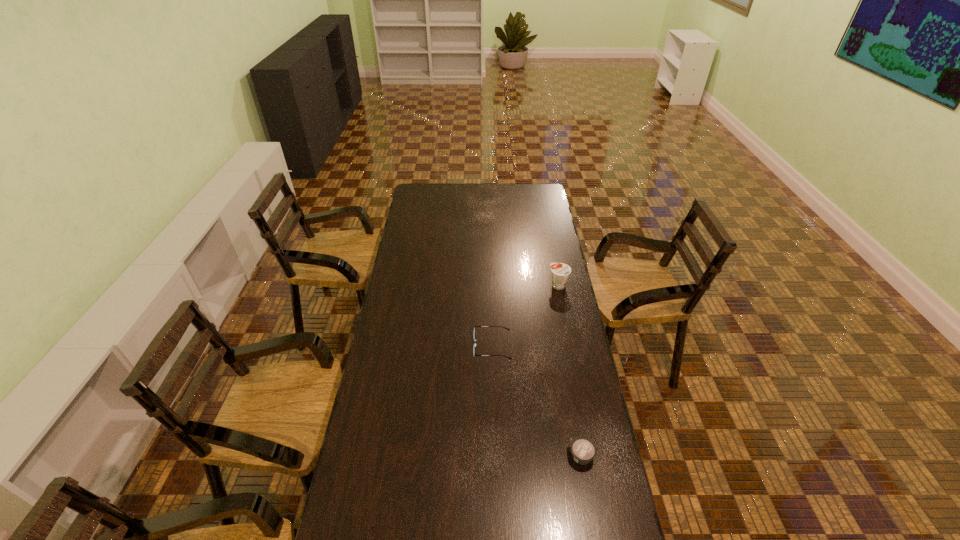
In order to click on vacant area in the image that satisfies the following two spatial constraints: 1. on the lenses of the nearest object; 2. on the left side of the spectacles in this screenshot , I will do `click(495, 456)`.

Where is `vacant space that satisfies the following two spatial constraints: 1. on the lenses of the second nearest object; 2. on the right side of the nearer yogurt`? The height and width of the screenshot is (540, 960). vacant space that satisfies the following two spatial constraints: 1. on the lenses of the second nearest object; 2. on the right side of the nearer yogurt is located at coordinates (495, 456).

I want to click on vacant region that satisfies the following two spatial constraints: 1. on the back side of the tallest object; 2. on the left side of the nearer yogurt, so click(551, 285).